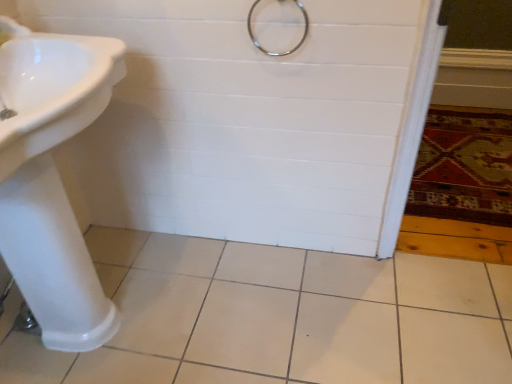
Question: From the image's perspective, does white ceramic tile at center appear higher than white glossy sink at left?

Choices:
 (A) no
 (B) yes

Answer: (A)

Question: Is white ceramic tile at center at the left side of white glossy sink at left?

Choices:
 (A) no
 (B) yes

Answer: (A)

Question: Is white ceramic tile at center next to white glossy sink at left?

Choices:
 (A) no
 (B) yes

Answer: (A)

Question: Is white ceramic tile at center oriented away from white glossy sink at left?

Choices:
 (A) no
 (B) yes

Answer: (A)

Question: Is white glossy sink at left located within white ceramic tile at center?

Choices:
 (A) yes
 (B) no

Answer: (B)

Question: Considering the positions of white ceramic tile at center and carpeted rug at lower right in the image, is white ceramic tile at center bigger or smaller than carpeted rug at lower right?

Choices:
 (A) small
 (B) big

Answer: (B)

Question: From their relative heights in the image, would you say white ceramic tile at center is taller or shorter than carpeted rug at lower right?

Choices:
 (A) tall
 (B) short

Answer: (A)

Question: Is white ceramic tile at center inside or outside of carpeted rug at lower right?

Choices:
 (A) outside
 (B) inside

Answer: (A)

Question: Looking at their shapes, would you say white ceramic tile at center is wider or thinner than carpeted rug at lower right?

Choices:
 (A) wide
 (B) thin

Answer: (B)

Question: From a real-world perspective, is metallic ring at upper center above or below carpeted rug at lower right?

Choices:
 (A) above
 (B) below

Answer: (A)

Question: Visually, is metallic ring at upper center positioned to the left or to the right of carpeted rug at lower right?

Choices:
 (A) left
 (B) right

Answer: (A)

Question: Based on their sizes in the image, would you say metallic ring at upper center is bigger or smaller than carpeted rug at lower right?

Choices:
 (A) big
 (B) small

Answer: (B)

Question: From the image's perspective, is metallic ring at upper center located above or below carpeted rug at lower right?

Choices:
 (A) above
 (B) below

Answer: (A)

Question: Considering the relative positions of white ceramic tile at center and metallic ring at upper center in the image provided, is white ceramic tile at center to the left or to the right of metallic ring at upper center?

Choices:
 (A) right
 (B) left

Answer: (A)

Question: In the image, is white ceramic tile at center positioned in front of or behind metallic ring at upper center?

Choices:
 (A) front
 (B) behind

Answer: (A)